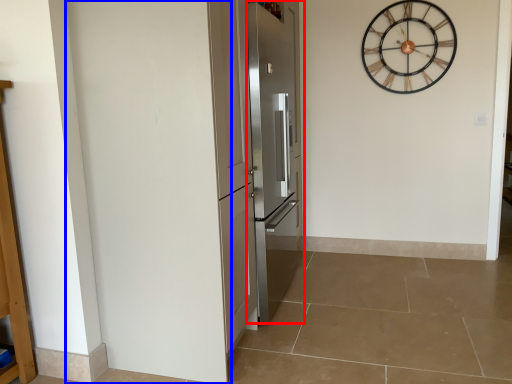
Question: Which object appears closest to the camera in this image, door (highlighted by a red box) or door (highlighted by a blue box)?

Choices:
 (A) door
 (B) door

Answer: (B)